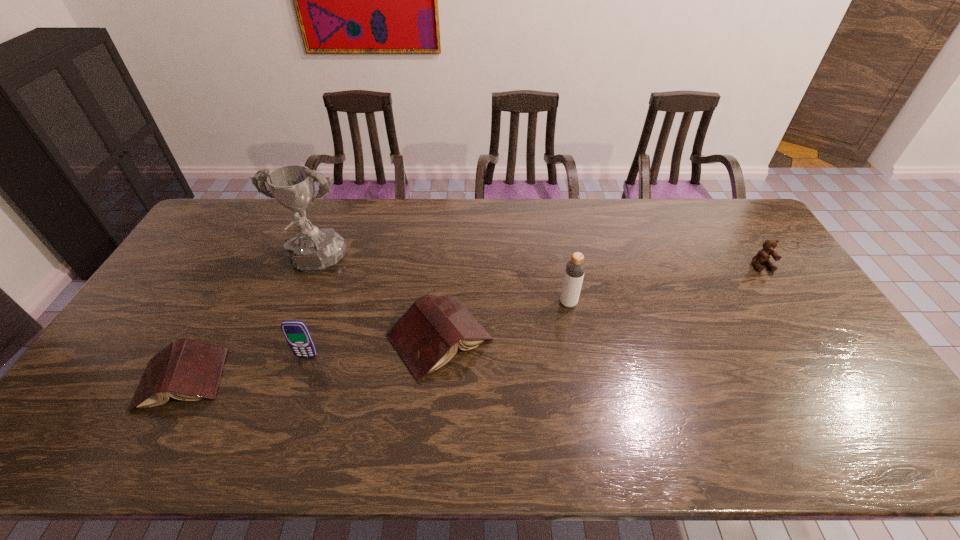
You are a GUI agent. You are given a task and a screenshot of the screen. Output one action in this format:
    pyautogui.click(x=<x>, y=<y>)
    Task: Click on the vacant position at the left edge of the desktop
    Image resolution: width=960 pixels, height=540 pixels.
    Given the screenshot: What is the action you would take?
    [134, 337]

This screenshot has height=540, width=960. Find the location of `vacant space at the far left corner`. vacant space at the far left corner is located at coordinates (224, 198).

At what (x,y) coordinates should I click in order to perform the action: click on vacant area at the far right corner of the desktop. Please return your answer as a coordinate pair (x, y). Looking at the image, I should click on (730, 201).

At what (x,y) coordinates should I click in order to perform the action: click on free point between the cellular telephone and the third object from right to left. Please return your answer as a coordinate pair (x, y). Looking at the image, I should click on (373, 347).

The height and width of the screenshot is (540, 960). Identify the location of free space that is in between the cellular telephone and the shorter book. (245, 368).

Identify the location of vacant area that lies between the right book and the bottle. This screenshot has width=960, height=540. (504, 320).

At what (x,y) coordinates should I click in order to perform the action: click on vacant region between the left book and the second object from right to left. Please return your answer as a coordinate pair (x, y). The width and height of the screenshot is (960, 540). Looking at the image, I should click on (375, 341).

Find the location of a particular element. Image resolution: width=960 pixels, height=540 pixels. blank region between the bottle and the tallest object is located at coordinates (442, 284).

Find the location of `vacant region between the fifth object from left to right and the rightmost object`. vacant region between the fifth object from left to right and the rightmost object is located at coordinates (665, 284).

Identify the location of unoccupied area between the fourth object from left to right and the fifth object from left to right. (504, 320).